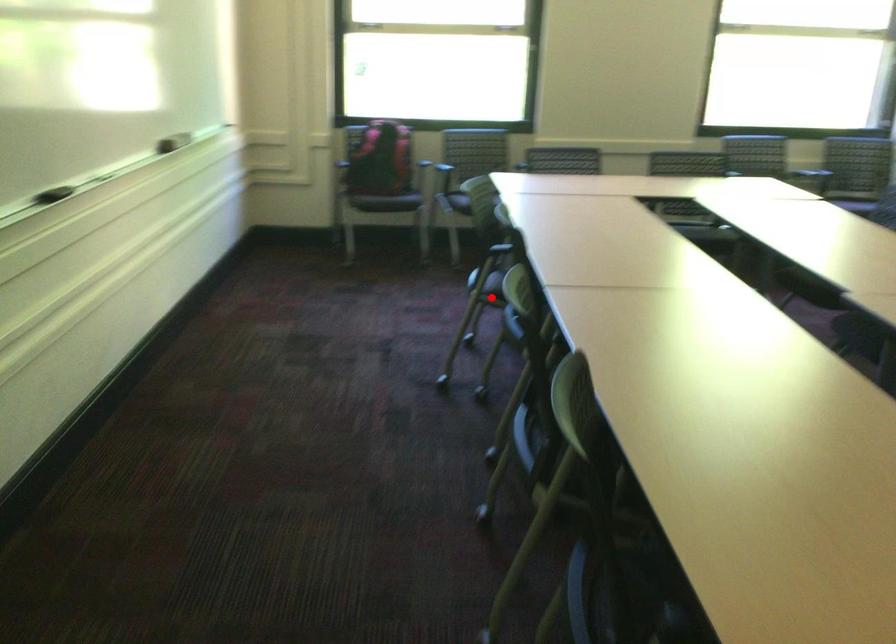
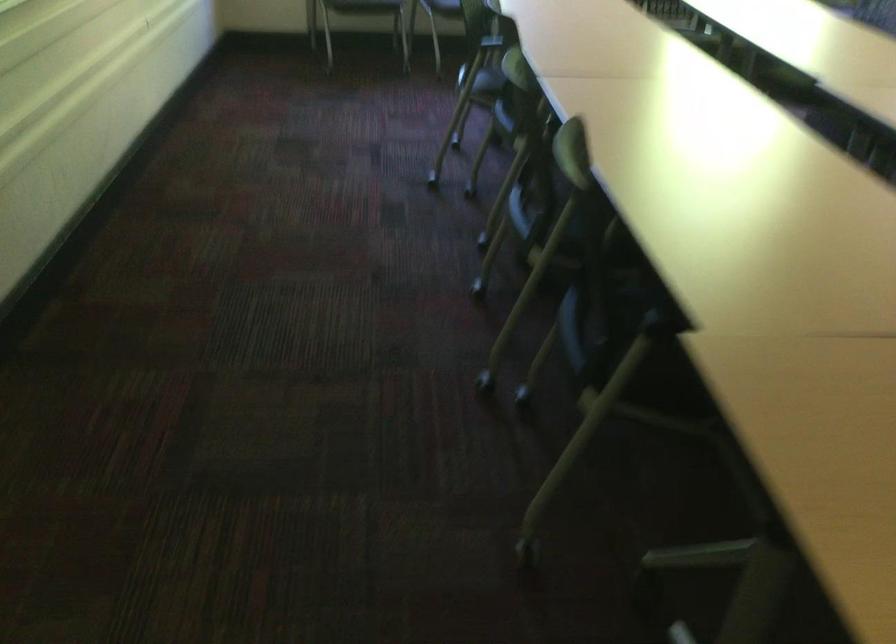
Locate, in the second image, the point that corresponds to the highlighted location in the first image.

(478, 93)